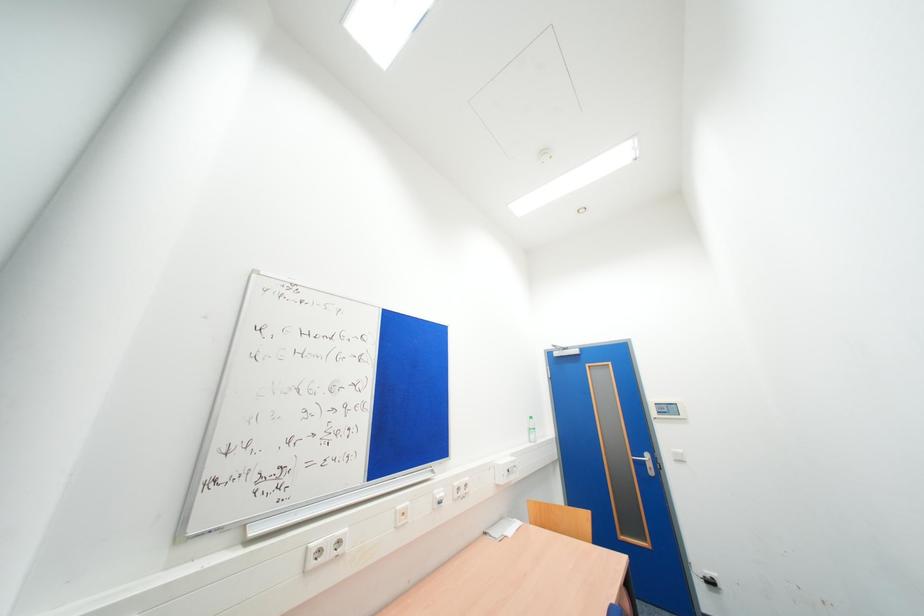
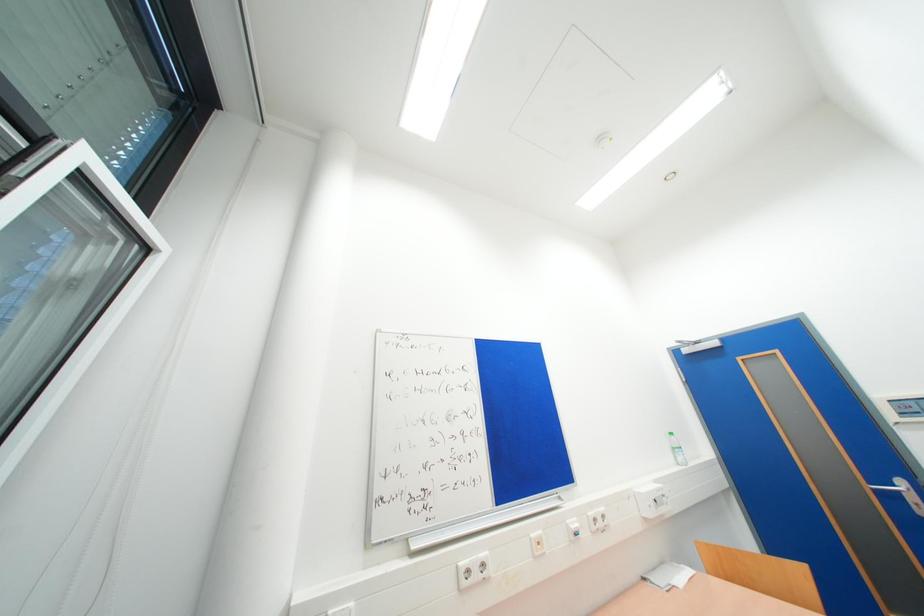
Question: How did the camera likely rotate?

Choices:
 (A) Left
 (B) Right
 (C) Up
 (D) Down

Answer: (A)